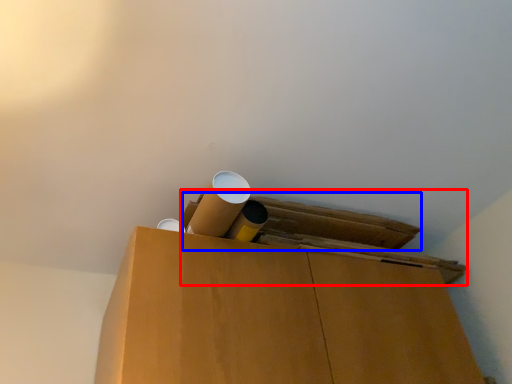
Question: Which of the following is the farthest to the observer, wide (highlighted by a red box) or wide (highlighted by a blue box)?

Choices:
 (A) wide
 (B) wide

Answer: (B)